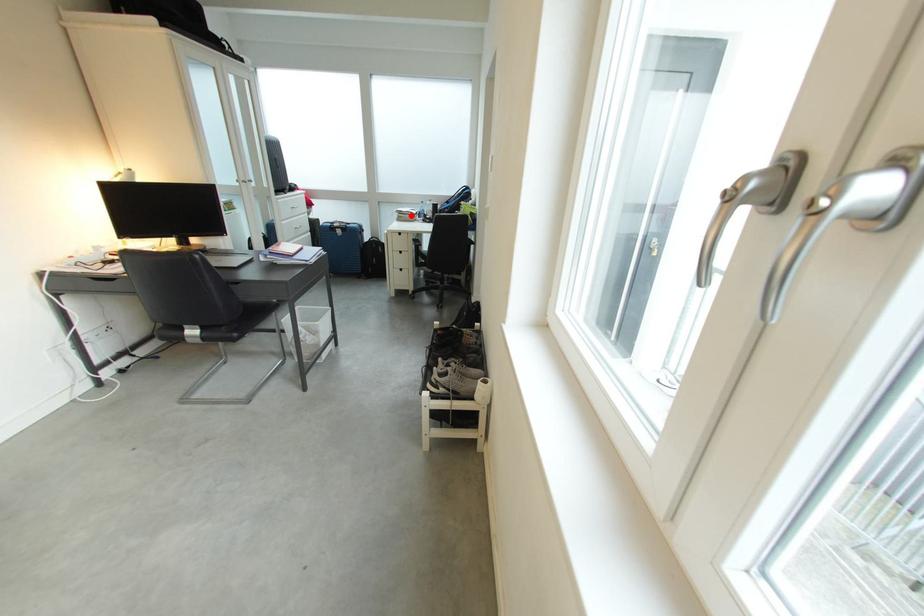
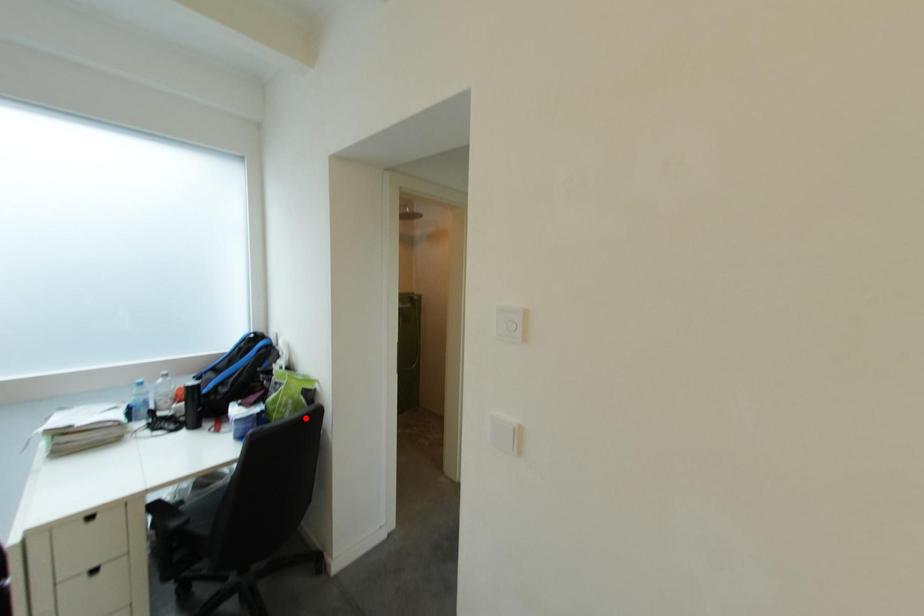
I am providing you with two images of the same scene from different viewpoints. A red point is marked on the first image and another point is marked on the second image. Do the highlighted points in image1 and image2 indicate the same real-world spot?

No